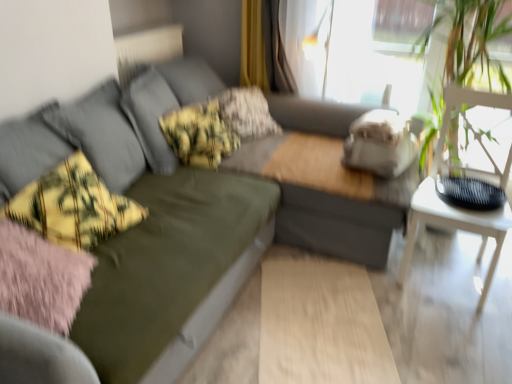
Question: From the image's perspective, is yellow-green plaid throw pillow at left located above or below olive green fabric couch at center?

Choices:
 (A) above
 (B) below

Answer: (B)

Question: Is yellow-green plaid throw pillow at left situated inside olive green fabric couch at center or outside?

Choices:
 (A) outside
 (B) inside

Answer: (B)

Question: Which object is positioned closest to the yellow-green plaid pillow at center, the 1th pillow in the front-to-back sequence?

Choices:
 (A) white wooden table at right
 (B) olive green fabric couch at center
 (C) olive green fabric couch at center
 (D) white textured radiator at upper left
 (E) floral fabric pillow at center, acting as the 1th pillow starting from the back

Answer: (E)

Question: Which of these objects is positioned farthest from the floral fabric pillow at center, acting as the 1th pillow starting from the back?

Choices:
 (A) yellow fabric curtain at upper center
 (B) white wooden table at right
 (C) olive green fabric couch at center
 (D) olive green fabric couch at center
 (E) yellow-green plaid throw pillow at left

Answer: (B)